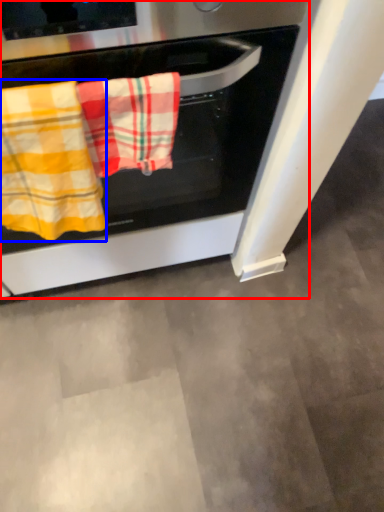
Question: Which point is closer to the camera, oven (highlighted by a red box) or beach towel (highlighted by a blue box)?

Choices:
 (A) oven
 (B) beach towel

Answer: (A)